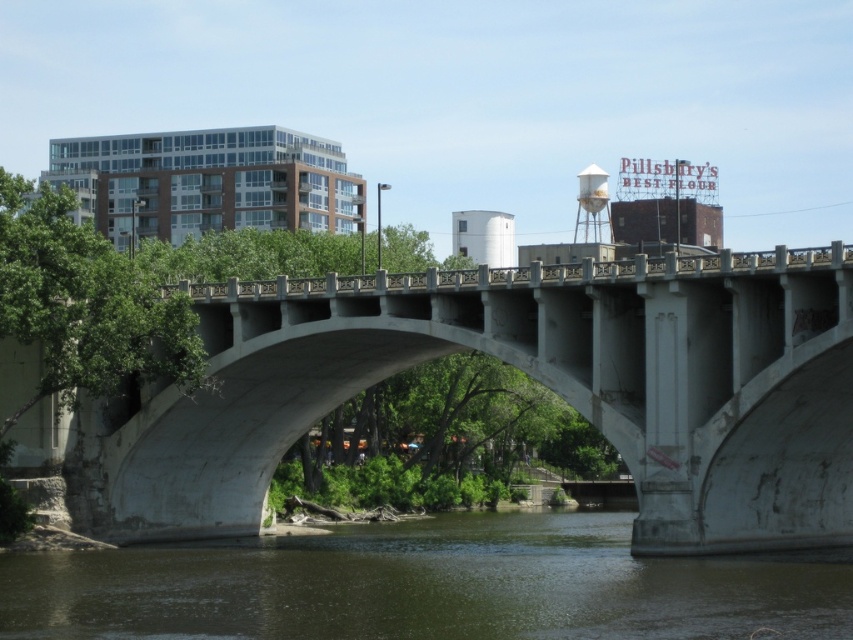
You are standing on the white concrete bridge at center and want to take a photo of the white matte water tower at upper center. Since both are white, how can you ensure the water tower is visible in your photo?

The white concrete bridge at center is in front of the white matte water tower at upper center, so you can angle your camera to capture the water tower beyond the bridge, ensuring it is not obscured by the bridge structure.

You are standing at a viewpoint 65.62 meters away from the white concrete bridge at center. If you want to take a photo of the bridge, will you need to zoom in or out to capture the entire structure in your camera frame?

Since the white concrete bridge at center is 65.62 meters away from your position, you would need to zoom out to ensure the entire structure fits within the camera frame.

You are standing on the bridge and looking down at the river. There is a point marked at coordinates (425,586). What do you see at that point?

At point (425,586) lies brown murky water at lower center.